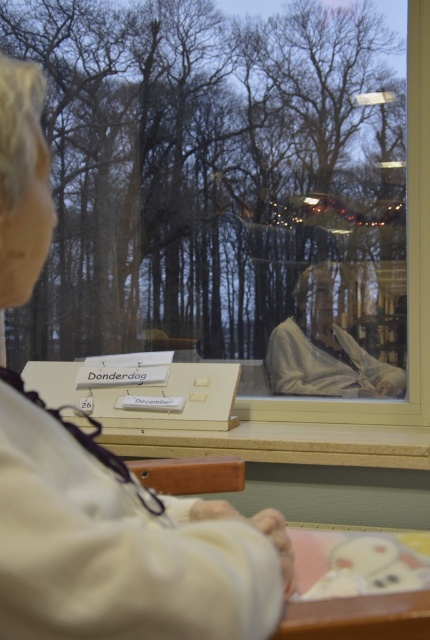
You are standing in a room and want to look outside through the transparent glass window at center. Where should you look to see the window?

You should look at the point with coordinates (x=237, y=198) to see the transparent glass window at center.

You are looking through the window and see two points marked on the table. The first point is at coordinate (70, 278) and the second is at (282, 372). Which point is closer to you?

Point (70, 278) is behind point (282, 372), so the second point at (282, 372) is closer to you.

From the picture: You are standing in a room and see the transparent glass window at center and the white fabric person at center. Which object is located to the right side of the other?

The transparent glass window at center is to the right of white fabric person at center according to the description.